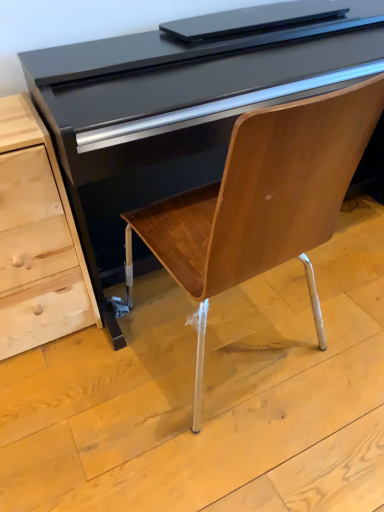
Find the location of a particular element. The height and width of the screenshot is (512, 384). vacant space in front of light wood chest of drawers at left is located at coordinates (52, 400).